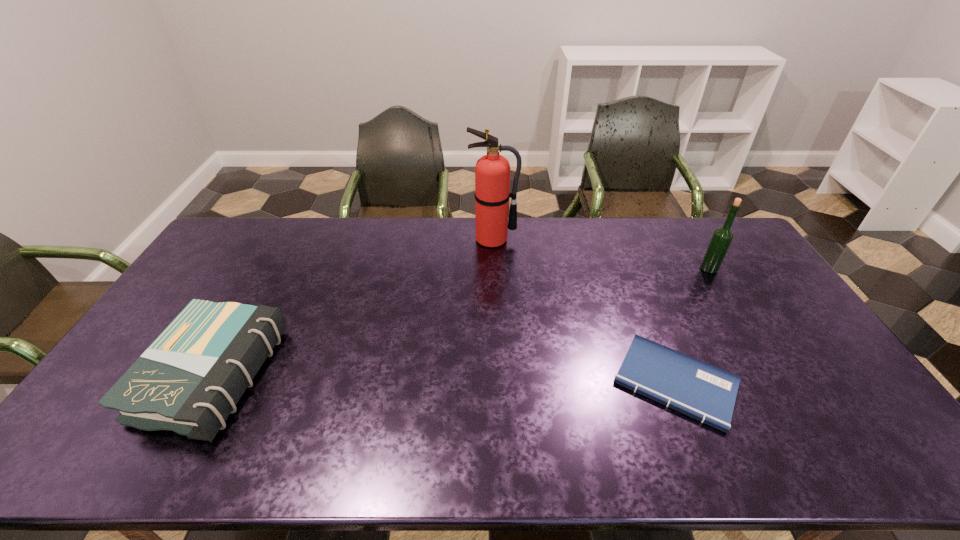
This screenshot has width=960, height=540. What are the coordinates of `empty location between the shortest object and the second tallest object` in the screenshot? It's located at (692, 326).

Identify which object is the third nearest to the taller paperback book. Please provide its 2D coordinates. Your answer should be formatted as a tuple, i.e. [(x, y)], where the tuple contains the x and y coordinates of a point satisfying the conditions above.

[(722, 237)]

Select which object is the second closest to the third shortest object. Please provide its 2D coordinates. Your answer should be formatted as a tuple, i.e. [(x, y)], where the tuple contains the x and y coordinates of a point satisfying the conditions above.

[(492, 171)]

This screenshot has height=540, width=960. I want to click on blank space that satisfies the following two spatial constraints: 1. at the nozzle of the third object from left to right; 2. on the right side of the tallest object, so click(498, 383).

Locate an element on the screen. free space that satisfies the following two spatial constraints: 1. at the nozzle of the second object from left to right; 2. on the right side of the shortest object is located at coordinates (498, 383).

The width and height of the screenshot is (960, 540). Find the location of `free space that satisfies the following two spatial constraints: 1. at the nozzle of the rightmost object; 2. on the left side of the tallest object`. free space that satisfies the following two spatial constraints: 1. at the nozzle of the rightmost object; 2. on the left side of the tallest object is located at coordinates (493, 269).

Identify the location of free spot that satisfies the following two spatial constraints: 1. at the nozzle of the farthest object; 2. on the right side of the shortest object. This screenshot has height=540, width=960. (498, 383).

Locate an element on the screen. This screenshot has height=540, width=960. vacant space that satisfies the following two spatial constraints: 1. on the front side of the left paperback book; 2. on the right side of the third object from left to right is located at coordinates (208, 383).